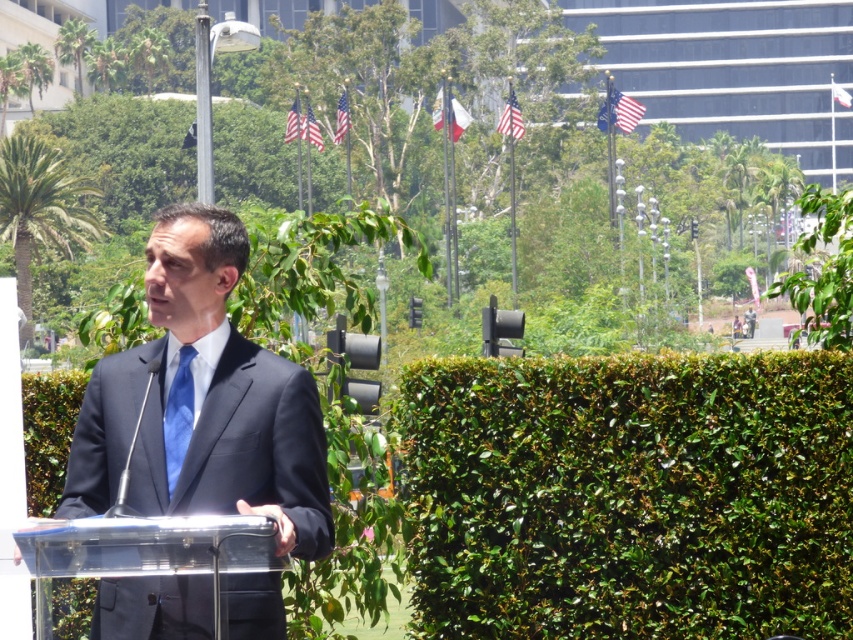
Question: Does green leafy hedge at right lie in front of satin blue tie at center?

Choices:
 (A) yes
 (B) no

Answer: (B)

Question: Estimate the real-world distances between objects in this image. Which object is farther from the dark blue suit at center?

Choices:
 (A) satin blue tie at center
 (B) green leafy hedge at right
 (C) transparent plastic podium at center

Answer: (B)

Question: Is the position of green leafy hedge at right more distant than that of satin blue tie at center?

Choices:
 (A) no
 (B) yes

Answer: (B)

Question: Estimate the real-world distances between objects in this image. Which object is farther from the dark blue suit at center?

Choices:
 (A) green leafy hedge at right
 (B) satin blue tie at center
 (C) transparent plastic podium at center

Answer: (A)

Question: Among these objects, which one is nearest to the camera?

Choices:
 (A) green leafy hedge at right
 (B) transparent plastic podium at center

Answer: (B)

Question: Does green leafy hedge at right lie behind dark blue suit at center?

Choices:
 (A) yes
 (B) no

Answer: (A)